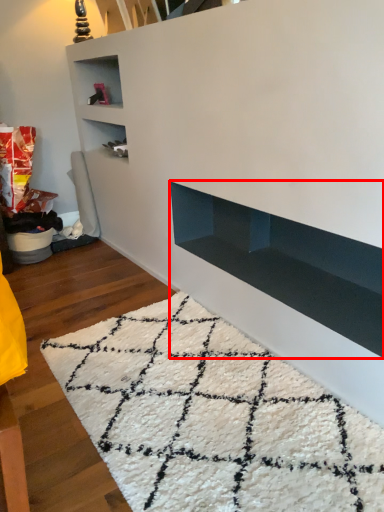
Question: Observing the image, what is the correct spatial positioning of shelf (annotated by the red box) in reference to mat?

Choices:
 (A) right
 (B) left

Answer: (A)